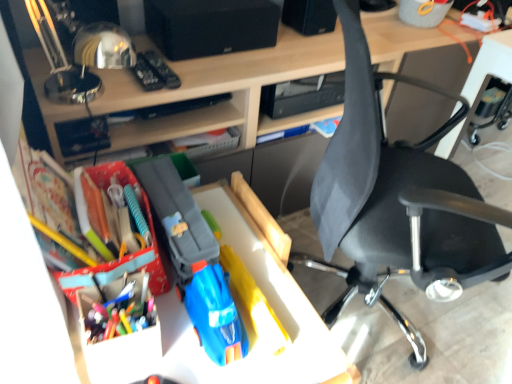
Question: Which is correct: multicolored plastic pen at center left is inside black fabric chair at right, or outside of it?

Choices:
 (A) outside
 (B) inside

Answer: (A)

Question: Is multicolored plastic pen at center left in front of or behind black fabric chair at right in the image?

Choices:
 (A) behind
 (B) front

Answer: (A)

Question: Estimate the real-world distances between objects in this image. Which object is closer to the black matte speaker at upper center?

Choices:
 (A) matte plastic toy car at center
 (B) multicolored plastic pen at center left
 (C) black fabric chair at right
 (D) matte plastic desk at center

Answer: (D)

Question: Estimate the real-world distances between objects in this image. Which object is farther from the black fabric chair at right?

Choices:
 (A) black matte speaker at upper center
 (B) multicolored plastic pen at center left
 (C) matte plastic desk at center
 (D) matte plastic toy car at center

Answer: (B)